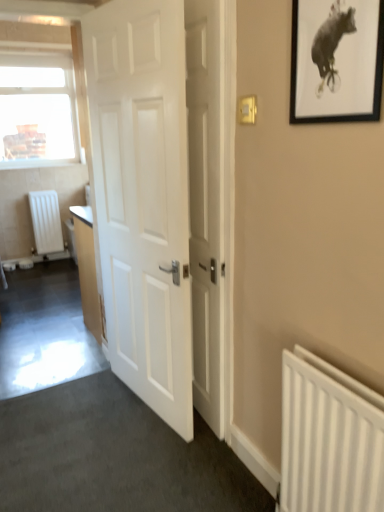
Question: Does white matte door at center, the 2th door positioned from the right, have a greater width compared to white matte radiator at lower right, the first radiator viewed from the right?

Choices:
 (A) no
 (B) yes

Answer: (B)

Question: Are white matte door at center, arranged as the 1th door when viewed from the left, and white matte radiator at lower right, arranged as the first radiator when ordered from the bottom, located far from each other?

Choices:
 (A) yes
 (B) no

Answer: (B)

Question: From the image's perspective, is white matte door at center, arranged as the 1th door when viewed from the left, under white matte radiator at lower right, arranged as the first radiator when ordered from the bottom?

Choices:
 (A) no
 (B) yes

Answer: (A)

Question: Is the depth of white matte door at center, arranged as the 1th door when viewed from the left, greater than that of white matte radiator at lower right, which appears as the 1th radiator when viewed from the front?

Choices:
 (A) yes
 (B) no

Answer: (A)

Question: Considering the relative sizes of white matte door at center, arranged as the 1th door when viewed from the left, and white matte radiator at lower right, the first radiator viewed from the right, in the image provided, is white matte door at center, arranged as the 1th door when viewed from the left, smaller than white matte radiator at lower right, the first radiator viewed from the right,?

Choices:
 (A) no
 (B) yes

Answer: (A)

Question: From a real-world perspective, is white matte door at center, arranged as the 1th door when viewed from the left, physically above white matte radiator at lower right, which appears as the 1th radiator when viewed from the front?

Choices:
 (A) no
 (B) yes

Answer: (B)

Question: Is the position of white matte radiator at left, the 1th radiator in the back-to-front sequence, more distant than that of black matte picture frame at upper right?

Choices:
 (A) no
 (B) yes

Answer: (B)

Question: Considering the relative sizes of white matte radiator at left, which is the 2th radiator from bottom to top, and black matte picture frame at upper right in the image provided, is white matte radiator at left, which is the 2th radiator from bottom to top, thinner than black matte picture frame at upper right?

Choices:
 (A) no
 (B) yes

Answer: (A)

Question: From a real-world perspective, is white matte radiator at left, which is the second radiator from front to back, positioned under black matte picture frame at upper right based on gravity?

Choices:
 (A) no
 (B) yes

Answer: (B)

Question: From a real-world perspective, does white matte radiator at left, the 1th radiator in the back-to-front sequence, stand above black matte picture frame at upper right?

Choices:
 (A) yes
 (B) no

Answer: (B)

Question: From the image's perspective, does white matte radiator at left, which is counted as the 2th radiator, starting from the right, appear higher than black matte picture frame at upper right?

Choices:
 (A) no
 (B) yes

Answer: (A)

Question: Can you confirm if white matte radiator at left, which is counted as the 2th radiator, starting from the right, is positioned to the left of black matte picture frame at upper right?

Choices:
 (A) no
 (B) yes

Answer: (B)

Question: Are white plastic light switch at upper right and white wooden door at center, which is the 1th door in right-to-left order, located far from each other?

Choices:
 (A) no
 (B) yes

Answer: (A)